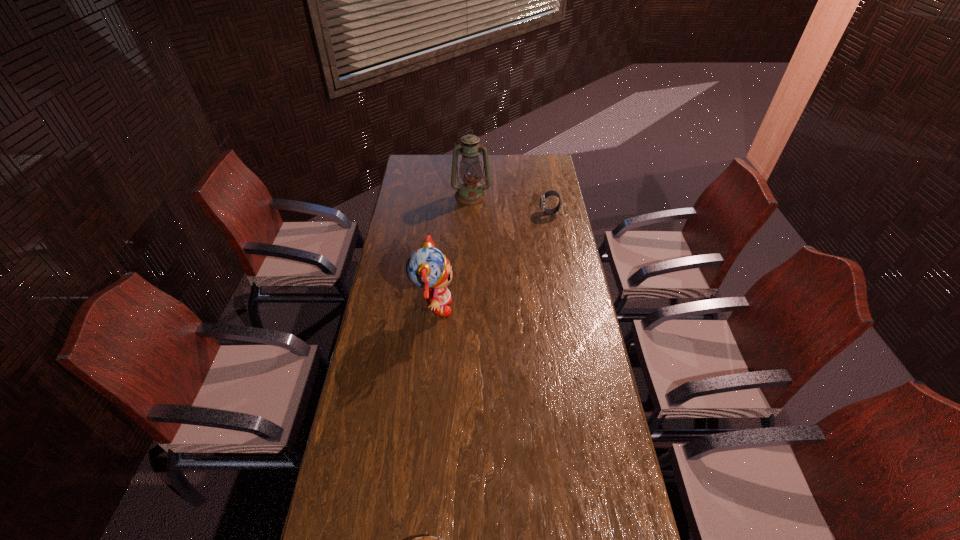
This screenshot has height=540, width=960. I want to click on oil lamp, so click(x=470, y=192).

You are a GUI agent. You are given a task and a screenshot of the screen. Output one action in this format:
    pyautogui.click(x=<x>, y=<y>)
    Task: Click on the tallest object
    This screenshot has height=540, width=960.
    Given the screenshot: What is the action you would take?
    pyautogui.click(x=470, y=192)

At what (x,y) coordinates should I click in order to perform the action: click on the third farthest object. Please return your answer as a coordinate pair (x, y). Looking at the image, I should click on (427, 267).

This screenshot has height=540, width=960. I want to click on doll, so click(x=427, y=267).

Where is `watch`? The width and height of the screenshot is (960, 540). watch is located at coordinates (549, 193).

Find the location of a particular element. the second farthest object is located at coordinates (549, 193).

Where is `vacant space located 0.170m on the left of the farthest object`? vacant space located 0.170m on the left of the farthest object is located at coordinates (419, 195).

I want to click on vacant space located on the face of the third shortest object, so click(x=528, y=308).

Identify the location of vacant area situated on the face of the third nearest object. The height and width of the screenshot is (540, 960). click(472, 213).

You are a GUI agent. You are given a task and a screenshot of the screen. Output one action in this format:
    pyautogui.click(x=<x>, y=<y>)
    Task: Click on the free space located 0.390m on the face of the third nearest object
    This screenshot has width=960, height=540.
    Given the screenshot: What is the action you would take?
    pyautogui.click(x=460, y=213)